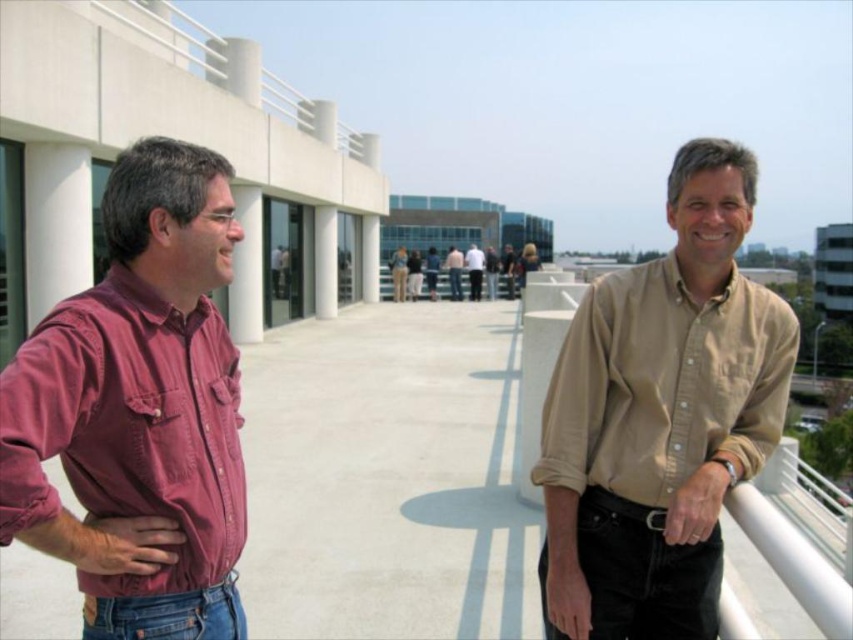
You are standing on the walkway and want to place a small potted plant exactly at point [660,417]. According to the scene, what object is located at that point?

The point [660,417] indicates the location of the beige cotton shirt at right.

You are standing on the rooftop walkway and need to locate the beige cotton shirt at right. According to the coordinates provided, where exactly is it positioned?

The beige cotton shirt at right is located at coordinates point (660, 417).

You are standing on the walkway and want to move from point A to point B. Given that point A is at coordinates point (573,378) and point B is at coordinates point (469,262), which direction should you move to get closer to point B?

To move from point A at coordinates point (573,378) to point B at coordinates point (469,262), you should move away from the viewer since point A is closer to the viewer than point B.